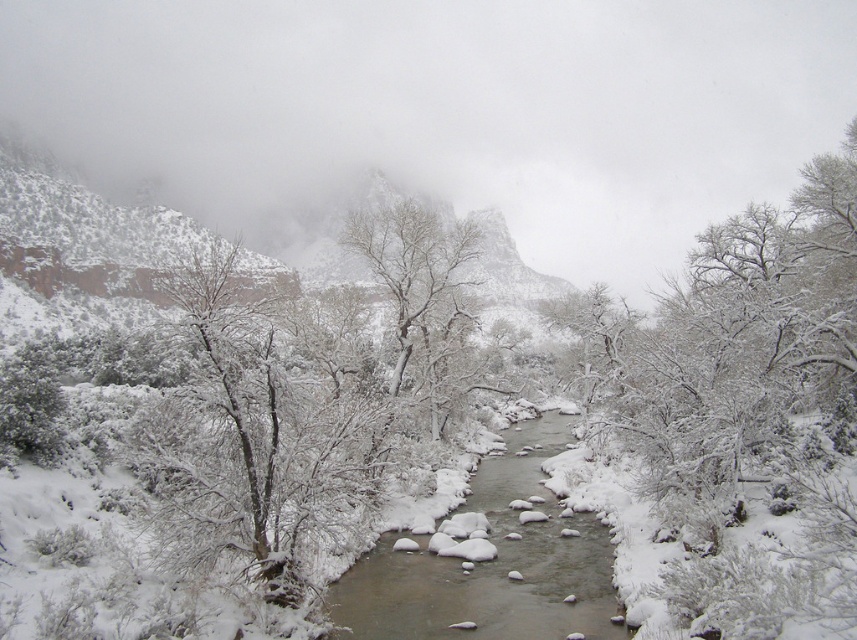
Who is higher up, snow-covered branches at center or white snowy stream at center?

snow-covered branches at center is higher up.

What are the coordinates of `snow-covered branches at center` in the screenshot? It's located at (309, 403).

Can you confirm if white snow-covered tree at center is thinner than white snowy stream at center?

→ No.

Can you confirm if white snow-covered tree at center is positioned below white snowy stream at center?

No.

Does point (628, 317) come farther from viewer compared to point (327, 595)?

Yes.

You are a GUI agent. You are given a task and a screenshot of the screen. Output one action in this format:
    pyautogui.click(x=<x>, y=<y>)
    Task: Click on the white snow-covered tree at center
    The image size is (857, 640).
    Given the screenshot: What is the action you would take?
    [741, 417]

Does white snow-covered tree at center appear on the left side of snow-covered branches at center?

In fact, white snow-covered tree at center is to the right of snow-covered branches at center.

Which is behind, point (834, 548) or point (286, 509)?

The point (286, 509) is more distant.

In order to click on white snow-covered tree at center in this screenshot , I will do `click(741, 417)`.